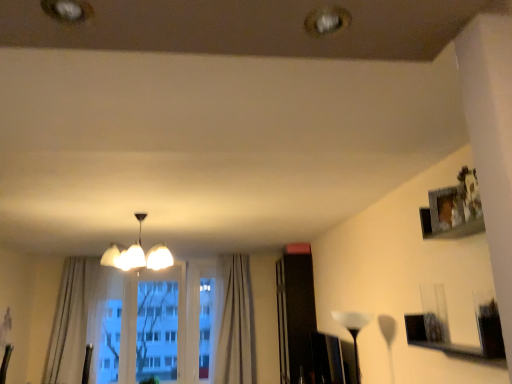
Question: Is point (356, 319) closer or farther from the camera than point (93, 261)?

Choices:
 (A) closer
 (B) farther

Answer: (A)

Question: Is white translucent lampshade at center, which is the 1th lamp from right to left, inside or outside of light beige fabric curtain at left, the first curtain from the left?

Choices:
 (A) inside
 (B) outside

Answer: (B)

Question: Which object is positioned closest to the white glossy chandelier at center, the first lamp positioned from the top?

Choices:
 (A) light beige fabric curtain at left, acting as the second curtain starting from the right
 (B) light beige textured curtain at center, which appears as the second curtain when viewed from the left
 (C) white translucent lampshade at center, positioned as the 2th lamp in left-to-right order
 (D) transparent glass window at center

Answer: (B)

Question: Based on their relative distances, which object is nearer to the light beige fabric curtain at left, the first curtain from the left?

Choices:
 (A) transparent glass window at center
 (B) white translucent lampshade at center, the 2th lamp from the top
 (C) white glossy chandelier at center, the second lamp from the bottom
 (D) light beige textured curtain at center, the 1th curtain viewed from the right

Answer: (A)